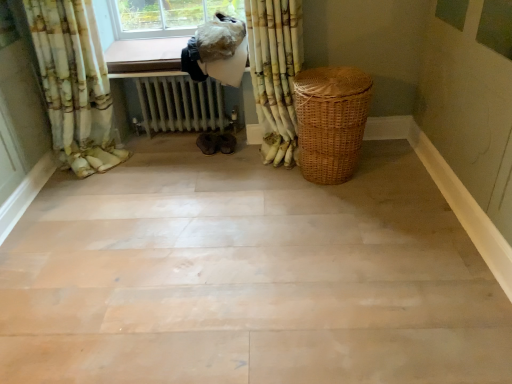
Question: Is wooden floor at center facing towards woven brown basket at right?

Choices:
 (A) yes
 (B) no

Answer: (B)

Question: Is wooden floor at center facing away from woven brown basket at right?

Choices:
 (A) yes
 (B) no

Answer: (B)

Question: Is woven brown basket at right a part of wooden floor at center?

Choices:
 (A) no
 (B) yes

Answer: (A)

Question: Is wooden floor at center smaller than woven brown basket at right?

Choices:
 (A) yes
 (B) no

Answer: (B)

Question: From the image's perspective, would you say wooden floor at center is shown under woven brown basket at right?

Choices:
 (A) yes
 (B) no

Answer: (A)

Question: From the image's perspective, is floral fabric curtain at upper left, placed as the second curtain when sorted from right to left, positioned above or below white metallic radiator at center?

Choices:
 (A) above
 (B) below

Answer: (A)

Question: Considering the relative positions of floral fabric curtain at upper left, the 1th curtain in the left-to-right sequence, and white metallic radiator at center in the image provided, is floral fabric curtain at upper left, the 1th curtain in the left-to-right sequence, to the left or to the right of white metallic radiator at center?

Choices:
 (A) right
 (B) left

Answer: (B)

Question: Considering the positions of floral fabric curtain at upper left, the 1th curtain in the left-to-right sequence, and white metallic radiator at center in the image, is floral fabric curtain at upper left, the 1th curtain in the left-to-right sequence, wider or thinner than white metallic radiator at center?

Choices:
 (A) thin
 (B) wide

Answer: (A)

Question: From a real-world perspective, is floral fabric curtain at upper left, placed as the second curtain when sorted from right to left, positioned above or below white metallic radiator at center?

Choices:
 (A) above
 (B) below

Answer: (A)

Question: From the image's perspective, is white textured curtain at upper right, placed as the 1th curtain when sorted from right to left, located above or below wooden floor at center?

Choices:
 (A) below
 (B) above

Answer: (B)

Question: Based on their positions, is white textured curtain at upper right, placed as the 1th curtain when sorted from right to left, located to the left or right of wooden floor at center?

Choices:
 (A) left
 (B) right

Answer: (B)

Question: Is white textured curtain at upper right, the second curtain in the left-to-right sequence, in front of or behind wooden floor at center in the image?

Choices:
 (A) front
 (B) behind

Answer: (B)

Question: Considering the positions of white textured curtain at upper right, the second curtain in the left-to-right sequence, and wooden floor at center in the image, is white textured curtain at upper right, the second curtain in the left-to-right sequence, wider or thinner than wooden floor at center?

Choices:
 (A) thin
 (B) wide

Answer: (A)

Question: In the image, is woven brown basket at right positioned in front of or behind white metallic radiator at center?

Choices:
 (A) behind
 (B) front

Answer: (B)

Question: Considering the positions of woven brown basket at right and white metallic radiator at center in the image, is woven brown basket at right bigger or smaller than white metallic radiator at center?

Choices:
 (A) small
 (B) big

Answer: (B)